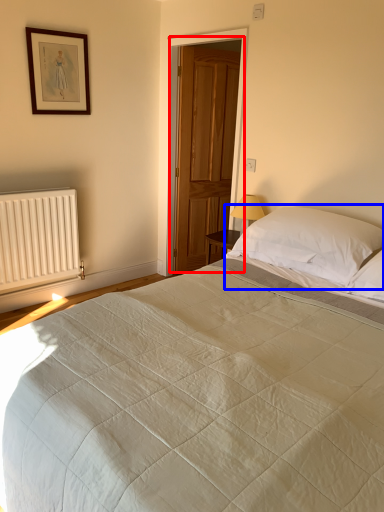
Question: Which object is further to the camera taking this photo, door (highlighted by a red box) or pillow (highlighted by a blue box)?

Choices:
 (A) door
 (B) pillow

Answer: (A)